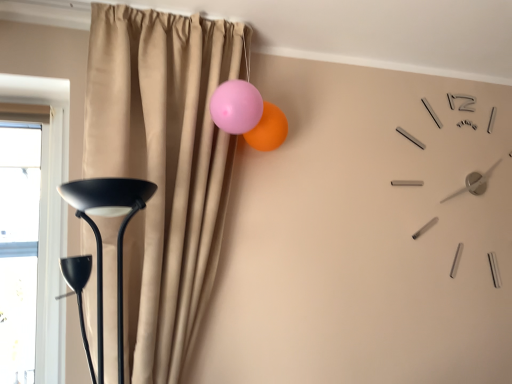
Question: Considering the relative sizes of transparent glass window at left and pink glossy balloon at upper center in the image provided, is transparent glass window at left thinner than pink glossy balloon at upper center?

Choices:
 (A) no
 (B) yes

Answer: (B)

Question: Does transparent glass window at left have a greater width compared to pink glossy balloon at upper center?

Choices:
 (A) yes
 (B) no

Answer: (B)

Question: Does transparent glass window at left come in front of pink glossy balloon at upper center?

Choices:
 (A) yes
 (B) no

Answer: (A)

Question: Does transparent glass window at left have a smaller size compared to pink glossy balloon at upper center?

Choices:
 (A) no
 (B) yes

Answer: (A)

Question: Does transparent glass window at left have a lesser height compared to pink glossy balloon at upper center?

Choices:
 (A) no
 (B) yes

Answer: (A)

Question: Based on their positions, is transparent glass window at left located to the left or right of beige curtain at upper center?

Choices:
 (A) left
 (B) right

Answer: (A)

Question: Is transparent glass window at left taller or shorter than beige curtain at upper center?

Choices:
 (A) tall
 (B) short

Answer: (B)

Question: Is point (15, 195) closer or farther from the camera than point (182, 160)?

Choices:
 (A) farther
 (B) closer

Answer: (A)

Question: From the image's perspective, is transparent glass window at left located above or below beige curtain at upper center?

Choices:
 (A) above
 (B) below

Answer: (B)

Question: Considering the positions of beige curtain at upper center and transparent glass window at left in the image, is beige curtain at upper center wider or thinner than transparent glass window at left?

Choices:
 (A) wide
 (B) thin

Answer: (A)

Question: In the image, is beige curtain at upper center on the left side or the right side of transparent glass window at left?

Choices:
 (A) left
 (B) right

Answer: (B)

Question: Relative to transparent glass window at left, is beige curtain at upper center in front or behind?

Choices:
 (A) front
 (B) behind

Answer: (A)

Question: From the image's perspective, is beige curtain at upper center positioned above or below transparent glass window at left?

Choices:
 (A) below
 (B) above

Answer: (B)

Question: From the image's perspective, is pink glossy balloon at upper center located above or below transparent glass window at left?

Choices:
 (A) below
 (B) above

Answer: (B)

Question: From their relative heights in the image, would you say pink glossy balloon at upper center is taller or shorter than transparent glass window at left?

Choices:
 (A) short
 (B) tall

Answer: (A)